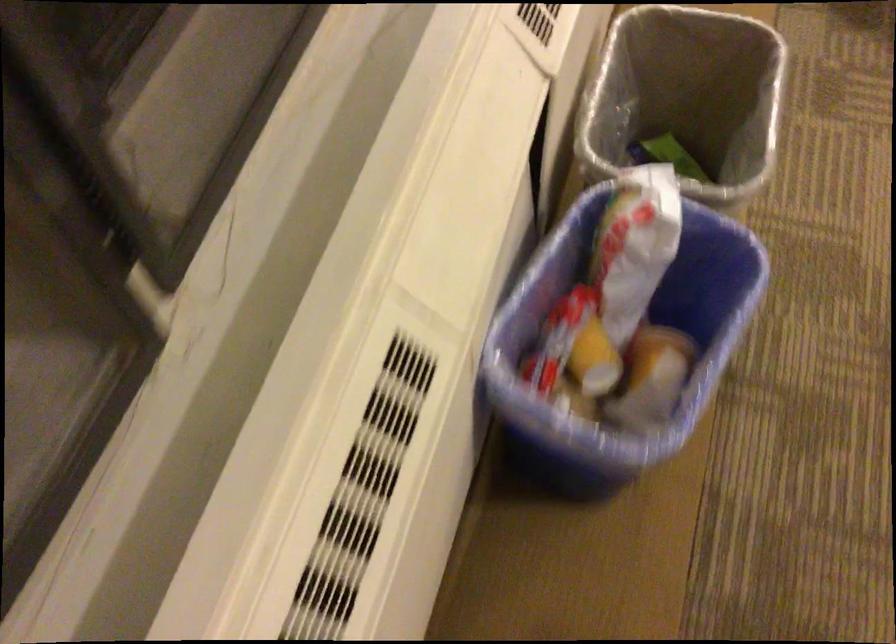
The location [621,343] corresponds to which object?

It corresponds to the blue recycling bin in the image.